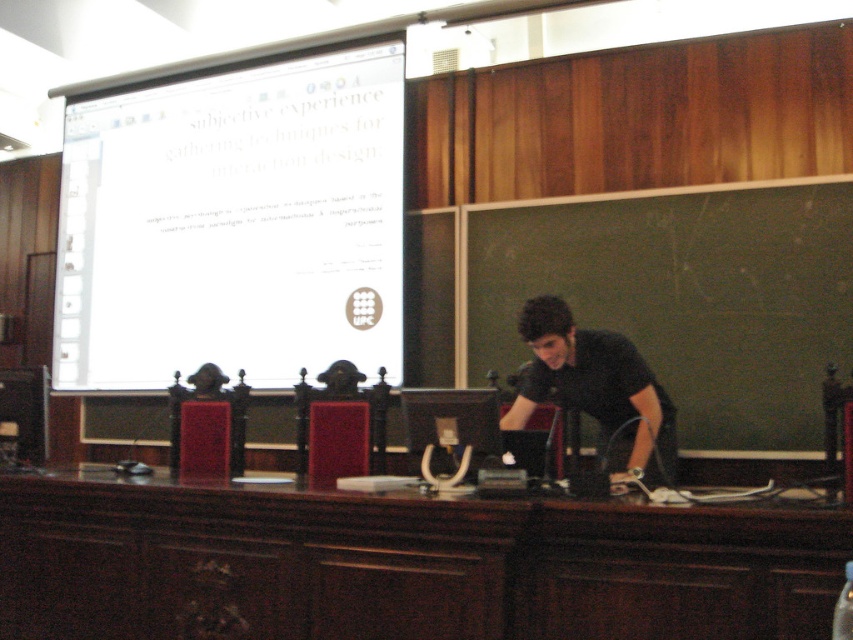
Question: Among these objects, which one is nearest to the camera?

Choices:
 (A) black matte shirt at center
 (B) green chalkboard at center

Answer: (A)

Question: Can you confirm if white glossy projection screen at upper center is positioned below green chalkboard at center?

Choices:
 (A) no
 (B) yes

Answer: (A)

Question: Which is nearer to the black matte shirt at center?

Choices:
 (A) dark wood table at center
 (B) green chalkboard at center
 (C) white glossy projection screen at upper center

Answer: (B)

Question: Is green chalkboard at center positioned in front of black matte shirt at center?

Choices:
 (A) no
 (B) yes

Answer: (A)

Question: Which point is closer to the camera?

Choices:
 (A) black matte shirt at center
 (B) dark wood table at center

Answer: (B)

Question: Is dark wood table at center behind white glossy projection screen at upper center?

Choices:
 (A) yes
 (B) no

Answer: (B)